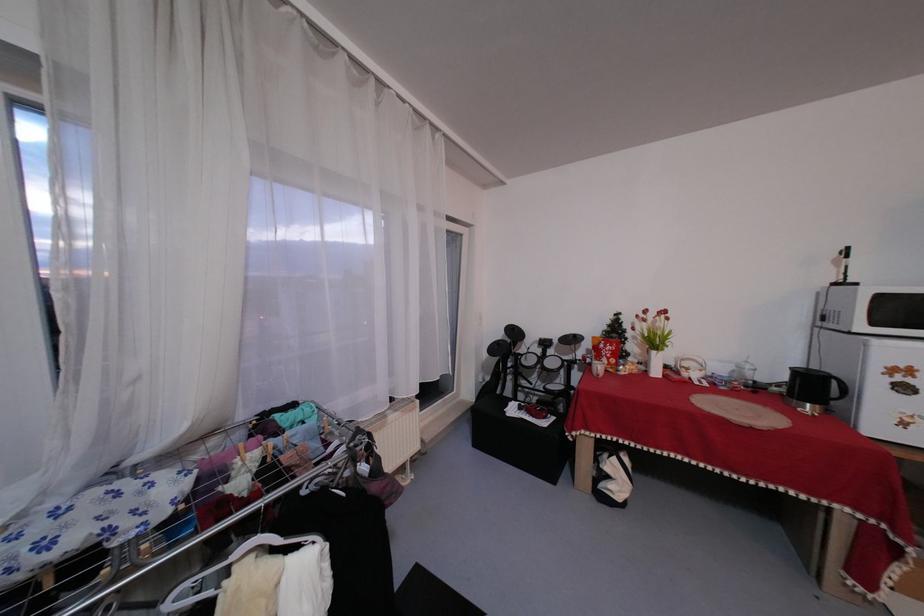
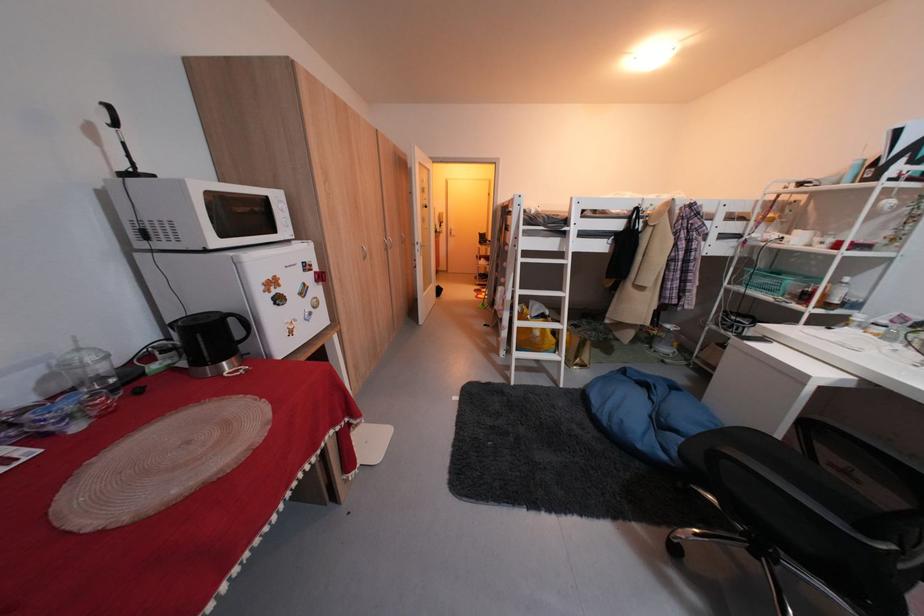
The point at (758, 363) is marked in the first image. Where is the corresponding point in the second image?

(91, 351)